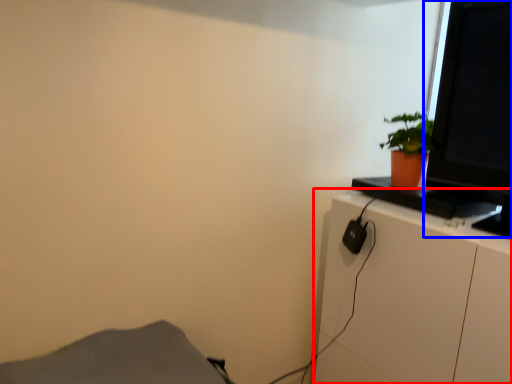
Question: Which object is closer to the camera taking this photo, cabinetry (highlighted by a red box) or computer monitor (highlighted by a blue box)?

Choices:
 (A) cabinetry
 (B) computer monitor

Answer: (A)